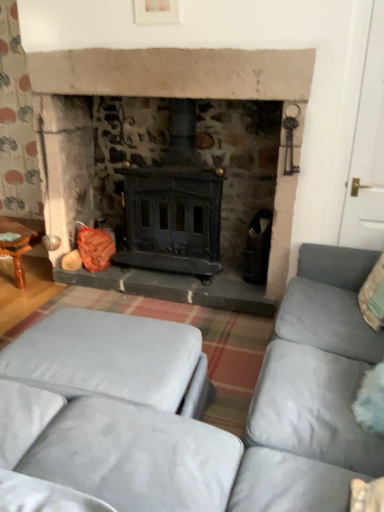
Question: Does point (345, 330) appear closer or farther from the camera than point (92, 313)?

Choices:
 (A) farther
 (B) closer

Answer: (B)

Question: Choose the correct answer: Is velvet grey couch at center inside velvet grey ottoman at lower left or outside it?

Choices:
 (A) outside
 (B) inside

Answer: (A)

Question: Estimate the real-world distances between objects in this image. Which object is farther from the wooden table at left?

Choices:
 (A) velvet grey couch at center
 (B) velvet grey ottoman at lower left

Answer: (A)

Question: Estimate the real-world distances between objects in this image. Which object is closer to the velvet grey couch at center?

Choices:
 (A) wooden table at left
 (B) velvet grey ottoman at lower left

Answer: (B)